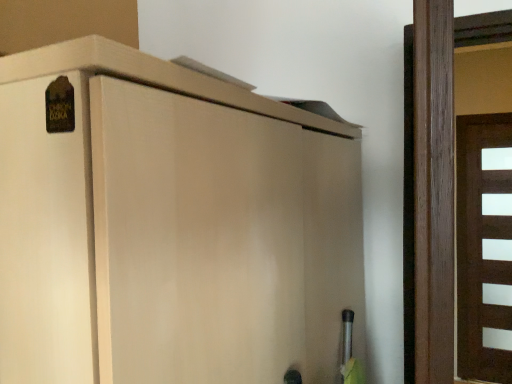
Question: From the image's perspective, would you say matte wood cupboard at upper left is shown under brown matte door at right, the second door viewed from the left?

Choices:
 (A) yes
 (B) no

Answer: (B)

Question: Is matte wood cupboard at upper left smaller than brown matte door at right, the 2th door when ordered from front to back?

Choices:
 (A) no
 (B) yes

Answer: (A)

Question: Would you say matte wood cupboard at upper left is a long distance from brown matte door at right, the 1th door positioned from the back?

Choices:
 (A) no
 (B) yes

Answer: (B)

Question: Can you confirm if matte wood cupboard at upper left is wider than brown matte door at right, the second door viewed from the left?

Choices:
 (A) yes
 (B) no

Answer: (A)

Question: Is the surface of matte wood cupboard at upper left in direct contact with brown matte door at right, the second door viewed from the left?

Choices:
 (A) yes
 (B) no

Answer: (B)

Question: Based on their sizes in the image, would you say brown matte door at right, the second door viewed from the left, is bigger or smaller than brown wooden door at right, acting as the 1th door starting from the left?

Choices:
 (A) small
 (B) big

Answer: (B)

Question: Considering the positions of brown matte door at right, the 1th door positioned from the back, and brown wooden door at right, acting as the 1th door starting from the left, in the image, is brown matte door at right, the 1th door positioned from the back, wider or thinner than brown wooden door at right, acting as the 1th door starting from the left,?

Choices:
 (A) thin
 (B) wide

Answer: (A)

Question: In terms of height, does brown matte door at right, placed as the 1th door when sorted from right to left, look taller or shorter compared to brown wooden door at right, the second door when ordered from back to front?

Choices:
 (A) short
 (B) tall

Answer: (B)

Question: Is brown matte door at right, placed as the 1th door when sorted from right to left, to the left or to the right of brown wooden door at right, which is counted as the 2th door, starting from the right, in the image?

Choices:
 (A) right
 (B) left

Answer: (A)

Question: Do you think matte wood cupboard at upper left is within brown matte door at right, the 2th door when ordered from front to back, or outside of it?

Choices:
 (A) outside
 (B) inside

Answer: (A)

Question: From the image's perspective, is matte wood cupboard at upper left above or below brown matte door at right, placed as the 1th door when sorted from right to left?

Choices:
 (A) below
 (B) above

Answer: (B)

Question: Considering the positions of point (86, 86) and point (503, 284), is point (86, 86) closer or farther from the camera than point (503, 284)?

Choices:
 (A) farther
 (B) closer

Answer: (B)

Question: Is matte wood cupboard at upper left taller or shorter than brown matte door at right, placed as the 1th door when sorted from right to left?

Choices:
 (A) tall
 (B) short

Answer: (B)

Question: Looking at their shapes, would you say brown matte door at right, the second door viewed from the left, is wider or thinner than matte wood cupboard at upper left?

Choices:
 (A) wide
 (B) thin

Answer: (B)

Question: In terms of size, does brown matte door at right, the second door viewed from the left, appear bigger or smaller than matte wood cupboard at upper left?

Choices:
 (A) big
 (B) small

Answer: (B)